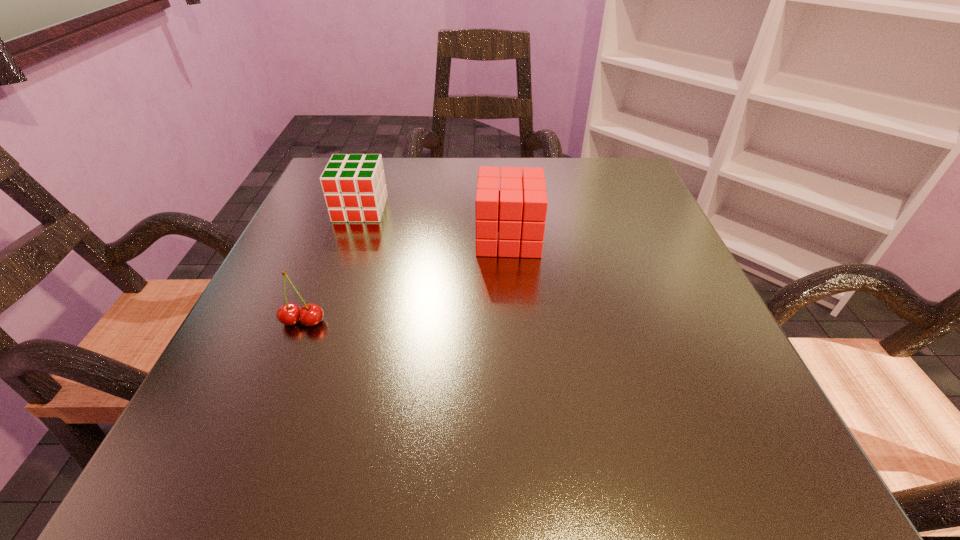
You are a GUI agent. You are given a task and a screenshot of the screen. Output one action in this format:
    pyautogui.click(x=<x>, y=<y>)
    Task: Click on the free space that is in between the shorter cube and the rightmost object
    
    Given the screenshot: What is the action you would take?
    pyautogui.click(x=435, y=224)

The image size is (960, 540). I want to click on free space between the left cube and the taller cube, so click(x=435, y=224).

Identify the location of free space between the left cube and the cherry. The image size is (960, 540). (332, 265).

Where is `free space that is in between the cherry and the taller cube`? This screenshot has width=960, height=540. free space that is in between the cherry and the taller cube is located at coordinates (406, 280).

Identify the location of vacant area that lies between the nearest object and the taller cube. (406, 280).

At what (x,y) coordinates should I click in order to perform the action: click on free space between the left cube and the cherry. Please return your answer as a coordinate pair (x, y). Looking at the image, I should click on (332, 265).

Locate an element on the screen. free space between the left cube and the cherry is located at coordinates (332, 265).

At what (x,y) coordinates should I click in order to perform the action: click on the second closest object to the cherry. Please return your answer as a coordinate pair (x, y). This screenshot has width=960, height=540. Looking at the image, I should click on (518, 211).

Select which object is the closest to the left cube. Please provide its 2D coordinates. Your answer should be formatted as a tuple, i.e. [(x, y)], where the tuple contains the x and y coordinates of a point satisfying the conditions above.

[(518, 211)]

You are a GUI agent. You are given a task and a screenshot of the screen. Output one action in this format:
    pyautogui.click(x=<x>, y=<y>)
    Task: Click on the blank space that satisfies the following two spatial constraints: 1. on the red face of the shorter cube; 2. on the right side of the rightmost object
    This screenshot has height=540, width=960.
    Given the screenshot: What is the action you would take?
    pyautogui.click(x=350, y=238)